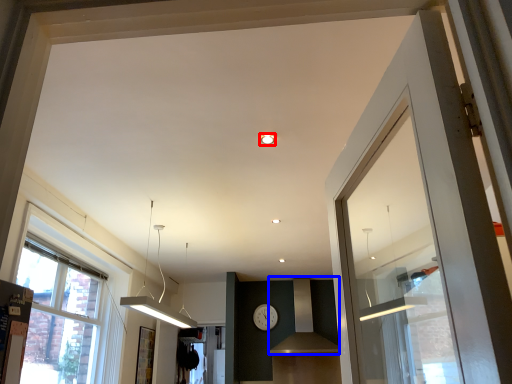
Question: Among these objects, which one is nearest to the camera, lighting (highlighted by a red box) or vent (highlighted by a blue box)?

Choices:
 (A) lighting
 (B) vent

Answer: (A)